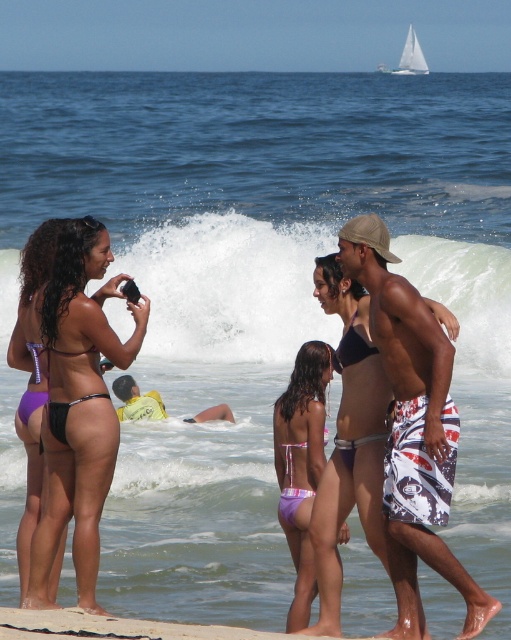
Looking at this image, you are a photographer trying to capture a photo of the printed board shorts at center and the purple matte bikini at left. Based on their positions, which one would appear larger in the photo?

The printed board shorts at center appears larger in the photo because it is taller than the purple matte bikini at left.

You are a swimwear designer observing the beach scene. You need to determine which purple bikini has a bigger size between the purple bikini bottom at center and the purple matte bikini at left. Which one is larger?

The purple bikini bottom at center has a larger size compared to the purple matte bikini at left.

You are a photographer planning to capture the white frothy wave at center and the purple shiny bikini at center in a single frame. Based on their sizes, which object should you focus on first to ensure both fit in the frame?

Since the white frothy wave at center is narrower than the purple shiny bikini at center, you should focus on capturing the purple shiny bikini at center first to ensure it fits, then adjust to include the smaller wave.